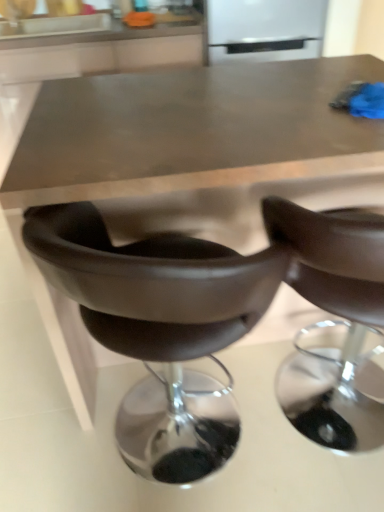
Question: In which direction should I rotate to look at brown leather chair at center, positioned as the first chair in front-to-back order?

Choices:
 (A) left
 (B) right

Answer: (B)

Question: Can you confirm if metallic brown table at center is thinner than brown leather chair at center, positioned as the first chair in front-to-back order?

Choices:
 (A) yes
 (B) no

Answer: (B)

Question: From the image's perspective, is metallic brown table at center located above brown leather chair at center, positioned as the first chair in front-to-back order?

Choices:
 (A) yes
 (B) no

Answer: (A)

Question: Are metallic brown table at center and brown leather chair at center, positioned as the first chair in front-to-back order, far apart?

Choices:
 (A) yes
 (B) no

Answer: (B)

Question: From a real-world perspective, does metallic brown table at center stand above brown leather chair at center, positioned as the first chair in front-to-back order?

Choices:
 (A) yes
 (B) no

Answer: (A)

Question: Considering the relative sizes of metallic brown table at center and brown leather chair at center, the second chair when ordered from back to front, in the image provided, is metallic brown table at center taller than brown leather chair at center, the second chair when ordered from back to front,?

Choices:
 (A) yes
 (B) no

Answer: (A)

Question: From a real-world perspective, is metallic brown table at center below brown leather chair at center, positioned as the first chair in front-to-back order?

Choices:
 (A) no
 (B) yes

Answer: (A)

Question: Can you confirm if leather-like brown chair at lower center, which ranks as the 1th chair in back-to-front order, is thinner than brown leather chair at center, the second chair when ordered from back to front?

Choices:
 (A) no
 (B) yes

Answer: (A)

Question: From the image's perspective, does leather-like brown chair at lower center, which ranks as the 1th chair in back-to-front order, appear lower than brown leather chair at center, positioned as the first chair in front-to-back order?

Choices:
 (A) yes
 (B) no

Answer: (A)

Question: Are leather-like brown chair at lower center, which ranks as the 1th chair in back-to-front order, and brown leather chair at center, positioned as the first chair in front-to-back order, making contact?

Choices:
 (A) no
 (B) yes

Answer: (A)

Question: Would you consider leather-like brown chair at lower center, which ranks as the 1th chair in back-to-front order, to be distant from brown leather chair at center, positioned as the first chair in front-to-back order?

Choices:
 (A) yes
 (B) no

Answer: (B)

Question: Can you confirm if leather-like brown chair at lower center, which ranks as the 1th chair in back-to-front order, is smaller than brown leather chair at center, positioned as the first chair in front-to-back order?

Choices:
 (A) yes
 (B) no

Answer: (B)

Question: From a real-world perspective, is leather-like brown chair at lower center, which is the 2th chair in front-to-back order, beneath brown leather chair at center, positioned as the first chair in front-to-back order?

Choices:
 (A) yes
 (B) no

Answer: (A)

Question: Is white glossy refrigerator at upper center next to brown leather chair at center, positioned as the first chair in front-to-back order?

Choices:
 (A) yes
 (B) no

Answer: (B)